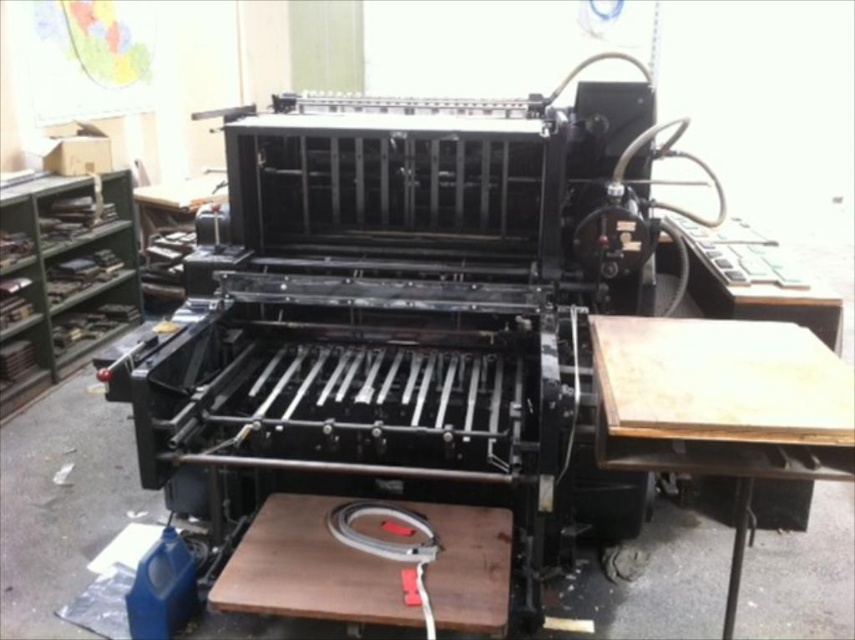
Can you confirm if wooden table at right is wider than brown wooden table at center?

No, wooden table at right is not wider than brown wooden table at center.

Identify the location of wooden table at right. (721, 406).